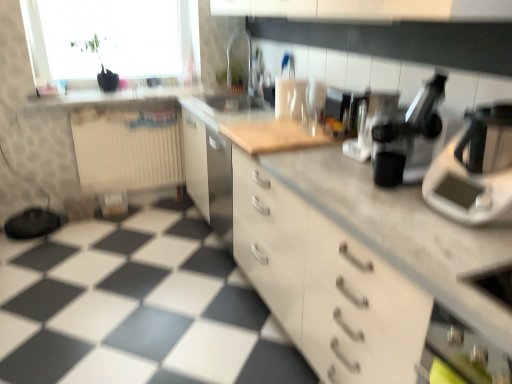
What are the coordinates of `free space above beige ribbed radiator at left (from a real-world perspective)` in the screenshot? It's located at (143, 104).